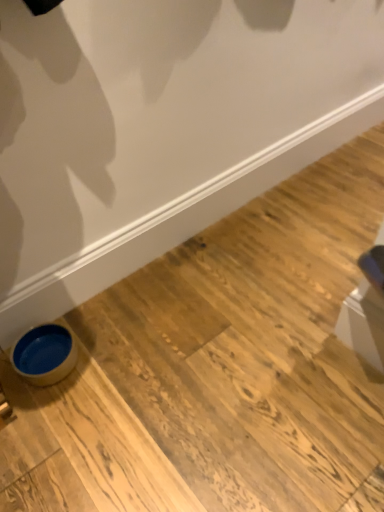
This screenshot has width=384, height=512. What are the coordinates of `free space in front of matte blue bowl at lower left` in the screenshot? It's located at (55, 418).